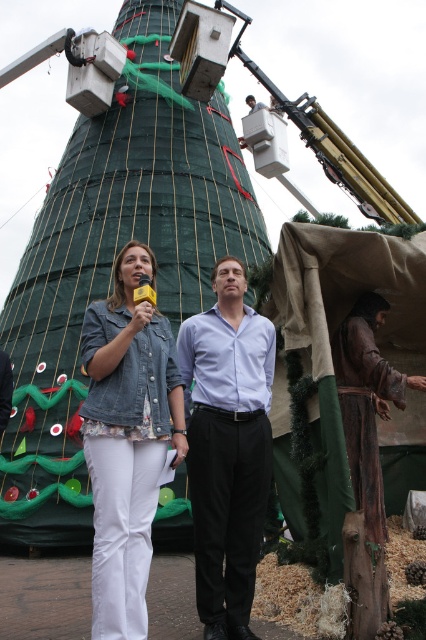
Question: Among these objects, which one is farthest from the camera?

Choices:
 (A) denim jacket at center
 (B) brown leather robe at lower right

Answer: (B)

Question: Is denim jacket at center further to camera compared to light blue shirt at center?

Choices:
 (A) no
 (B) yes

Answer: (A)

Question: Based on their relative distances, which object is farther from the brown leather robe at lower right?

Choices:
 (A) light blue shirt at center
 (B) green netted tower at center
 (C) denim jacket at center

Answer: (B)

Question: Does light blue shirt at center appear under brown leather robe at lower right?

Choices:
 (A) yes
 (B) no

Answer: (A)

Question: Does light blue shirt at center have a larger size compared to brown leather robe at lower right?

Choices:
 (A) yes
 (B) no

Answer: (A)

Question: Which of the following is the farthest from the observer?

Choices:
 (A) brown leather robe at lower right
 (B) denim jacket at center
 (C) green netted tower at center
 (D) light blue shirt at center

Answer: (C)